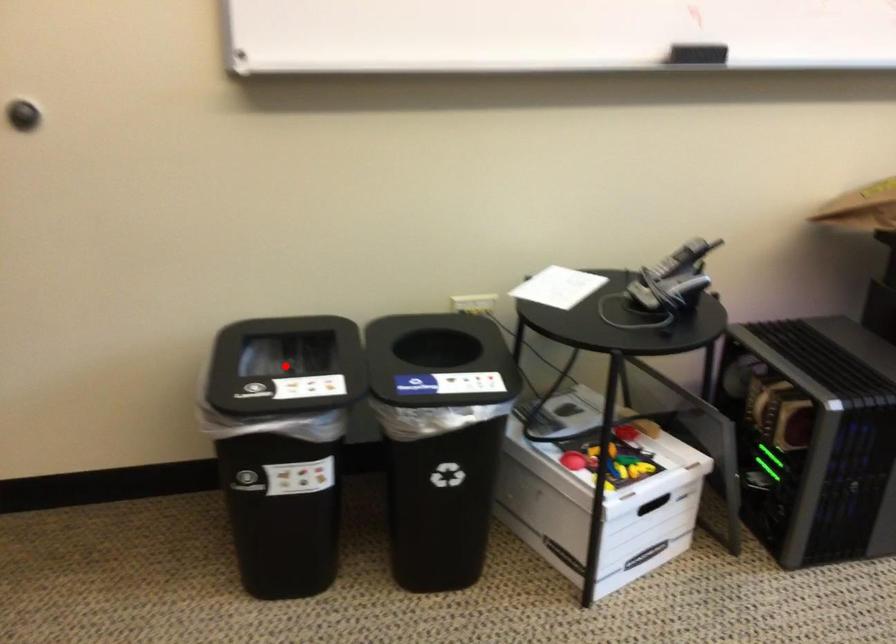
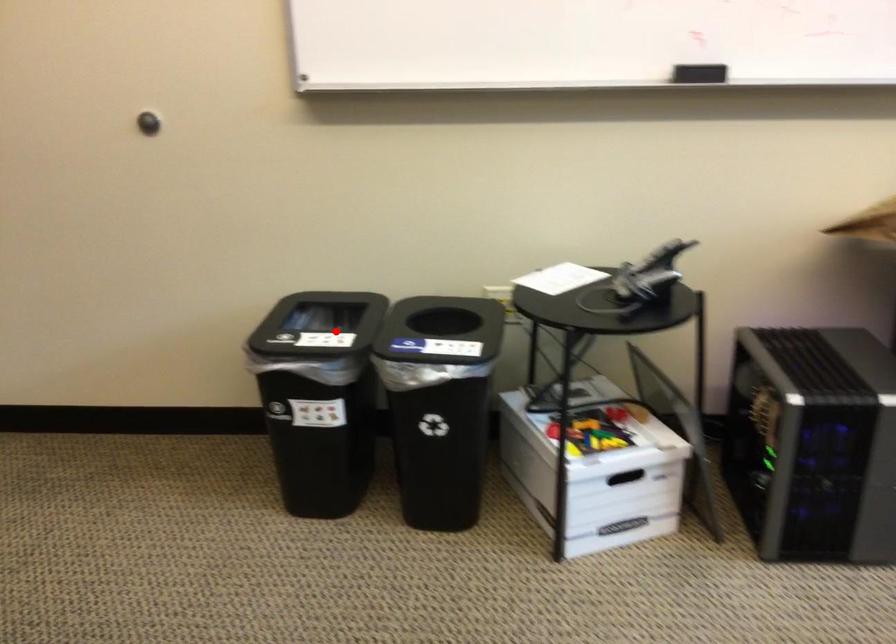
I am providing you with two images of the same scene from different viewpoints. A red point is marked on the first image and another point is marked on the second image. Is the red point in image1 aligned with the point shown in image2?

Yes